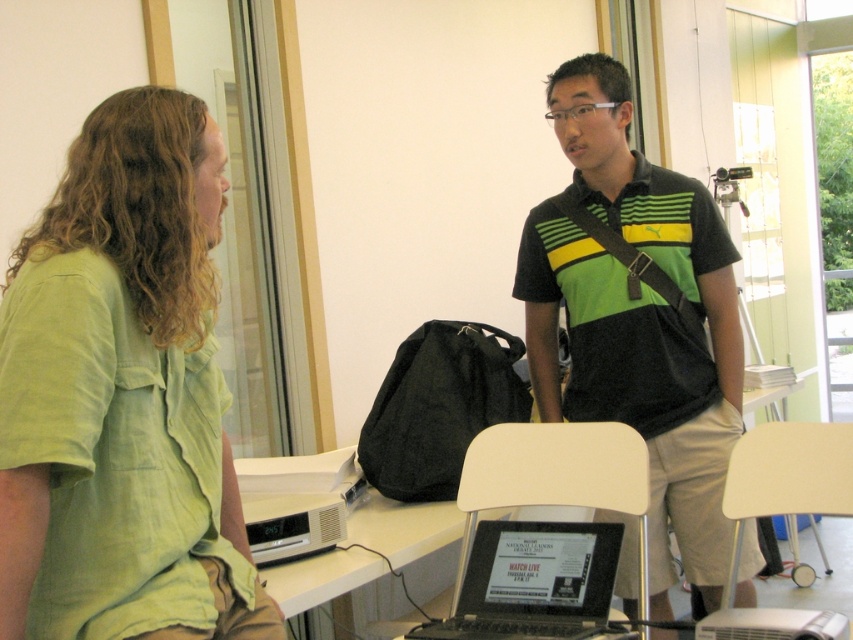
You are a photographer setting up for a portrait. You have two points marked in the image for focus. The first point is at coordinate point (734,596) and the second is at point (529,586). Which point should you focus on to ensure the subject closer to the camera is in focus?

Point (529,586) should be focused on because it is closer to the camera than point (734,596).

You are standing in the room and want to hand a document to both people wearing green shirts. The document needs to be placed equidistant between them. Given the distance between the green cotton shirt at left and the green striped polo shirt at center, can you estimate the midpoint where you should place the document?

The green cotton shirt at left is 3.82 feet away from the green striped polo shirt at center. To place the document equidistant between them, you should position it approximately 1.91 feet from each shirt, which is half of the total distance between them.

You are trying to see the laptop screen clearly from where you are standing. Which object is closer to you, the green striped polo shirt at center or the black glossy laptop at lower center?

The green striped polo shirt at center is closer to you than the black glossy laptop at lower center because it is further to the viewer.